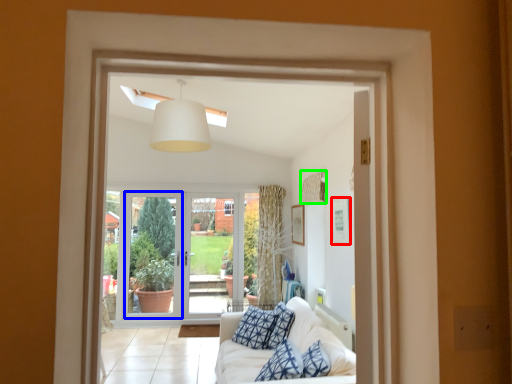
Question: Considering the real-world distances, which object is closest to picture frame (highlighted by a red box)? screen door (highlighted by a blue box) or curtain (highlighted by a green box).

Choices:
 (A) screen door
 (B) curtain

Answer: (B)